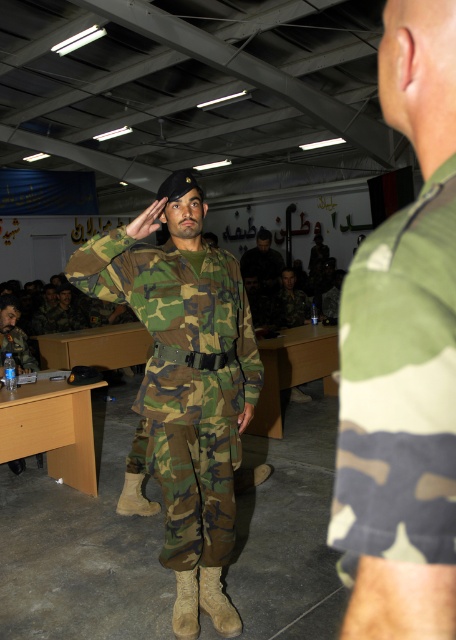
You are a photographer setting up a shoot in this military training facility. You need to position a large camera tripod between the camo fabric uniform at center and the matte camouflage uniform at center. Based on their widths, will the tripod fit between them without touching either uniform?

The camo fabric uniform at center might be wider than matte camouflage uniform at center, so there is uncertainty about the total space between them. Without exact measurements, it is unclear if the tripod will fit without touching either uniform.

Please describe the location of the camo fabric uniform at right in the image using the coordinate system provided in the Objects Description.

The camo fabric uniform at right is located at point [399,388].